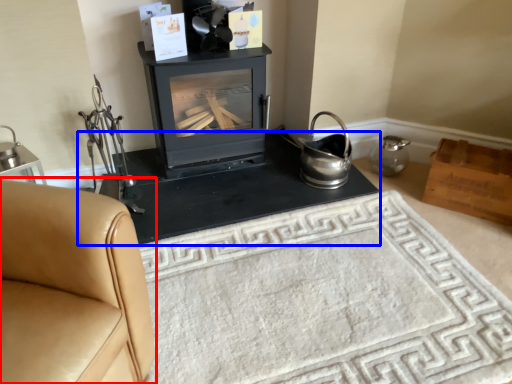
Question: Which point is closer to the camera, furniture (highlighted by a red box) or table (highlighted by a blue box)?

Choices:
 (A) furniture
 (B) table

Answer: (A)